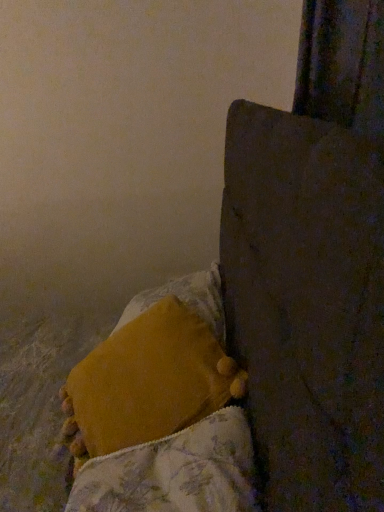
Question: Is fluffy yellow blanket at lower left not within velvety yellow pillow at lower center?

Choices:
 (A) yes
 (B) no

Answer: (A)

Question: Is fluffy yellow blanket at lower left placed right next to velvety yellow pillow at lower center?

Choices:
 (A) yes
 (B) no

Answer: (B)

Question: Is fluffy yellow blanket at lower left positioned with its back to velvety yellow pillow at lower center?

Choices:
 (A) yes
 (B) no

Answer: (B)

Question: Is fluffy yellow blanket at lower left positioned in front of velvety yellow pillow at lower center?

Choices:
 (A) no
 (B) yes

Answer: (B)

Question: Is fluffy yellow blanket at lower left oriented towards velvety yellow pillow at lower center?

Choices:
 (A) no
 (B) yes

Answer: (A)

Question: Is fluffy yellow blanket at lower left spatially inside velvety yellow pillow at lower center, or outside of it?

Choices:
 (A) outside
 (B) inside

Answer: (A)

Question: Is fluffy yellow blanket at lower left in front of or behind velvety yellow pillow at lower center in the image?

Choices:
 (A) behind
 (B) front

Answer: (B)

Question: In the image, is fluffy yellow blanket at lower left on the left side or the right side of velvety yellow pillow at lower center?

Choices:
 (A) right
 (B) left

Answer: (A)

Question: From a real-world perspective, is fluffy yellow blanket at lower left positioned above or below velvety yellow pillow at lower center?

Choices:
 (A) above
 (B) below

Answer: (B)

Question: Is fluffy yellow blanket at lower left to the left or to the right of wooden bedpost at upper right in the image?

Choices:
 (A) right
 (B) left

Answer: (A)

Question: From a real-world perspective, relative to wooden bedpost at upper right, is fluffy yellow blanket at lower left vertically above or below?

Choices:
 (A) below
 (B) above

Answer: (A)

Question: Is fluffy yellow blanket at lower left taller or shorter than wooden bedpost at upper right?

Choices:
 (A) short
 (B) tall

Answer: (A)

Question: Relative to wooden bedpost at upper right, is fluffy yellow blanket at lower left in front or behind?

Choices:
 (A) front
 (B) behind

Answer: (B)

Question: Is velvety yellow pillow at lower center in front of or behind wooden bedpost at upper right in the image?

Choices:
 (A) front
 (B) behind

Answer: (B)

Question: Based on their sizes in the image, would you say velvety yellow pillow at lower center is bigger or smaller than wooden bedpost at upper right?

Choices:
 (A) big
 (B) small

Answer: (B)